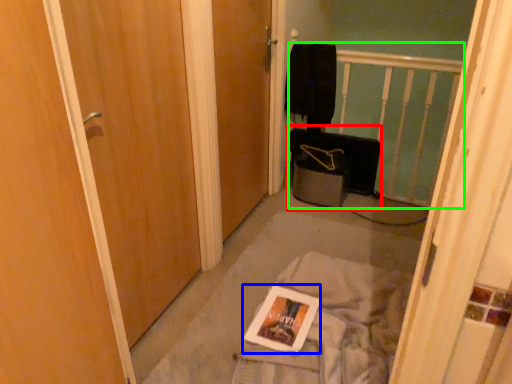
Question: Which object is the farthest from luggage (highlighted by a red box)? Choose among these: magazine (highlighted by a blue box) or balustrade (highlighted by a green box).

Choices:
 (A) magazine
 (B) balustrade

Answer: (A)